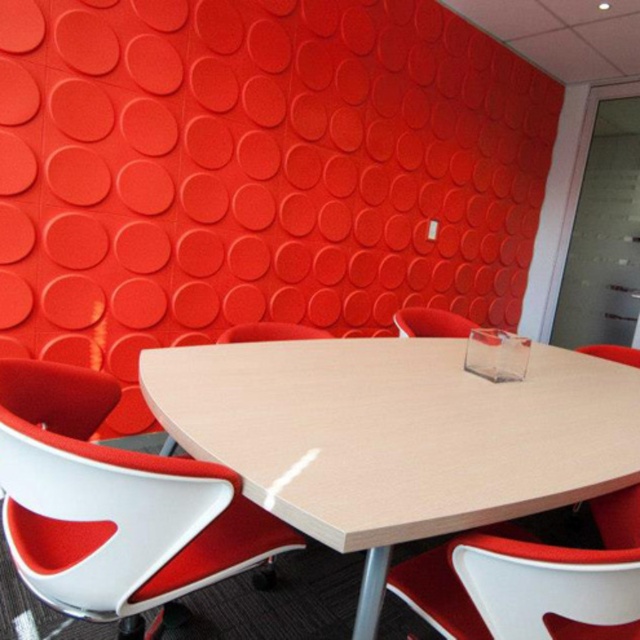
Question: Is white plastic swivel chair at lower left to the left of white matte chair at center from the viewer's perspective?

Choices:
 (A) no
 (B) yes

Answer: (B)

Question: Where is white matte chair at lower right located in relation to matte red chair at center in the image?

Choices:
 (A) left
 (B) right

Answer: (B)

Question: Which of the following is the closest to the observer?

Choices:
 (A) light wood/wooden table at center
 (B) matte red chair at center

Answer: (A)

Question: Is white matte plastic chair at lower right smaller than white matte chair at lower right?

Choices:
 (A) yes
 (B) no

Answer: (B)

Question: Which point is farther to the camera?

Choices:
 (A) (102, 385)
 (B) (609, 509)
 (C) (468, 566)
 (D) (275, 330)

Answer: (D)

Question: Which point is closer to the camera taking this photo?

Choices:
 (A) (400, 317)
 (B) (141, 566)

Answer: (B)